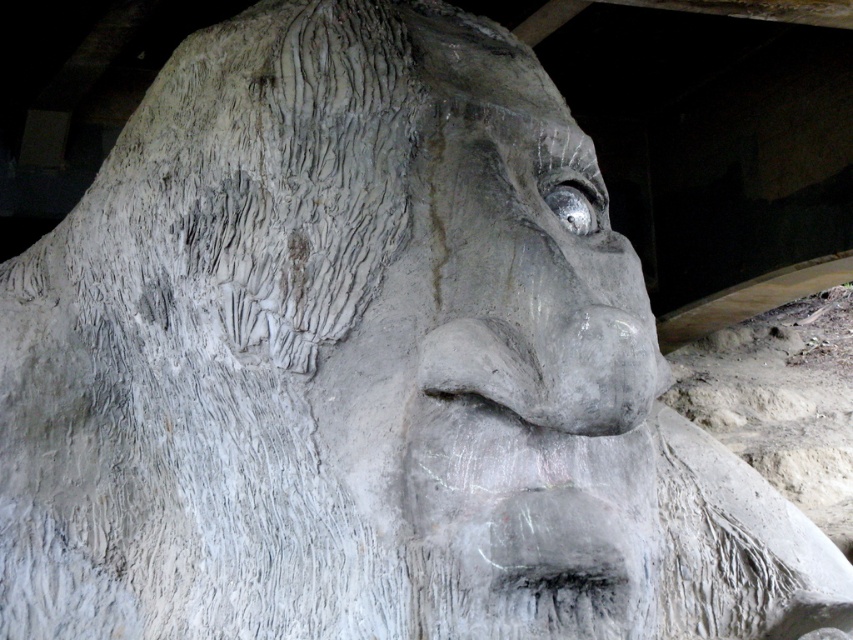
You are an art restorer examining the gray stone face at center and the gray textured nose at center. Which object has a greater width?

The gray stone face at center has a greater width than the gray textured nose at center.

You are an art conservator examining the large stone sculpture. You notice the gray textured nose at center and the metallic reflective eye at upper center. Which part of the sculpture is nearer to your current position?

The gray textured nose at center is closer to the viewer than the metallic reflective eye at upper center, so the nose is nearer to your position.